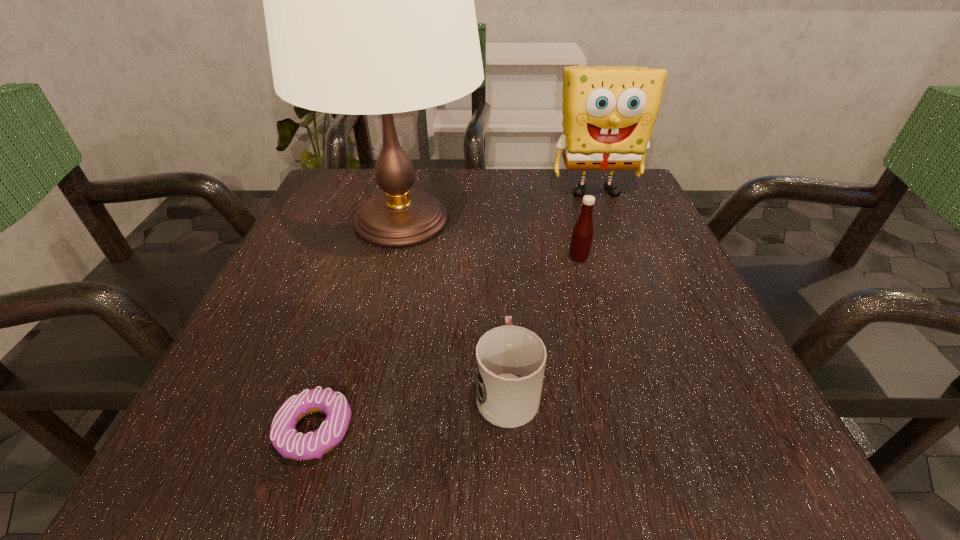
In order to click on vacant space that's between the doughnut and the Tabasco sauce in this screenshot , I will do `click(446, 344)`.

Image resolution: width=960 pixels, height=540 pixels. In order to click on empty space between the fourth tallest object and the sponge in this screenshot , I will do `click(551, 289)`.

At what (x,y) coordinates should I click in order to perform the action: click on free space between the lamp and the doughnut. Please return your answer as a coordinate pair (x, y). Image resolution: width=960 pixels, height=540 pixels. Looking at the image, I should click on (358, 325).

Where is `unoccupied position between the shortest object and the fourth tallest object`? unoccupied position between the shortest object and the fourth tallest object is located at coordinates (411, 409).

Locate an element on the screen. empty space that is in between the fourth shortest object and the tallest object is located at coordinates (498, 205).

Identify the location of vacant area between the fourth tallest object and the doughnut. The image size is (960, 540). (411, 409).

At what (x,y) coordinates should I click in order to perform the action: click on free space between the lamp and the doughnut. Please return your answer as a coordinate pair (x, y). The image size is (960, 540). Looking at the image, I should click on (358, 325).

Select which object appears as the closest to the fourth shortest object. Please provide its 2D coordinates. Your answer should be formatted as a tuple, i.e. [(x, y)], where the tuple contains the x and y coordinates of a point satisfying the conditions above.

[(582, 235)]

This screenshot has height=540, width=960. In order to click on object that ranks as the third closest to the tallest object in this screenshot , I will do `click(510, 360)`.

Identify the location of free space that satisfies the following two spatial constraints: 1. on the handle side of the second shortest object; 2. on the left side of the Tabasco sauce. The width and height of the screenshot is (960, 540). (500, 258).